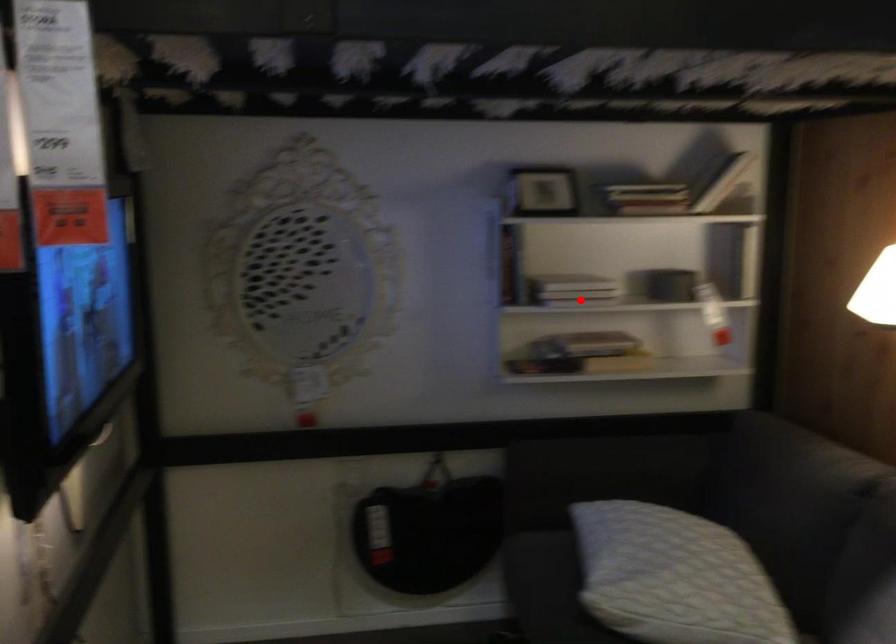
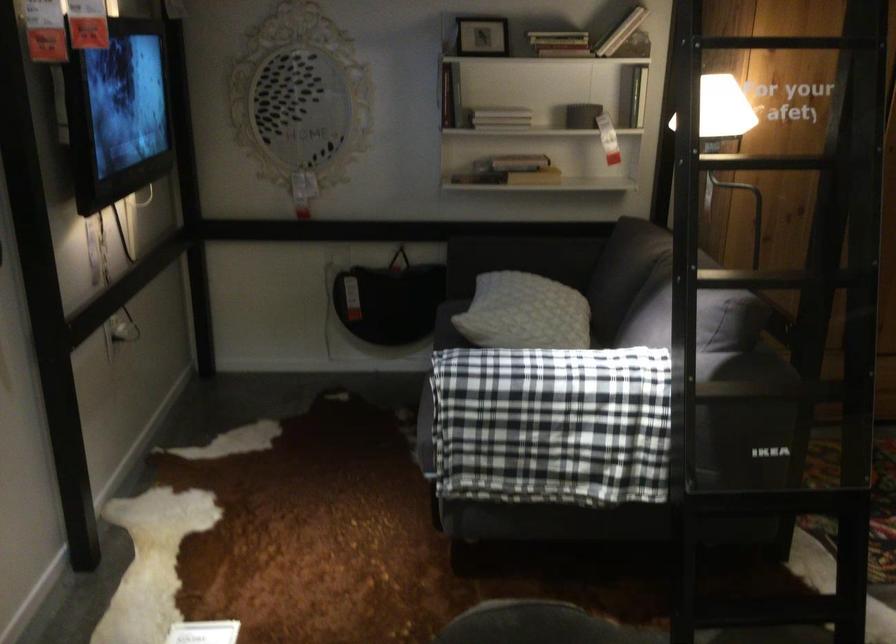
Question: I am providing you with two images of the same scene from different viewpoints. Given a red point in image1, look at the same physical point in image2. Is it:

Choices:
 (A) Closer to the viewpoint
 (B) Farther from the viewpoint

Answer: (B)